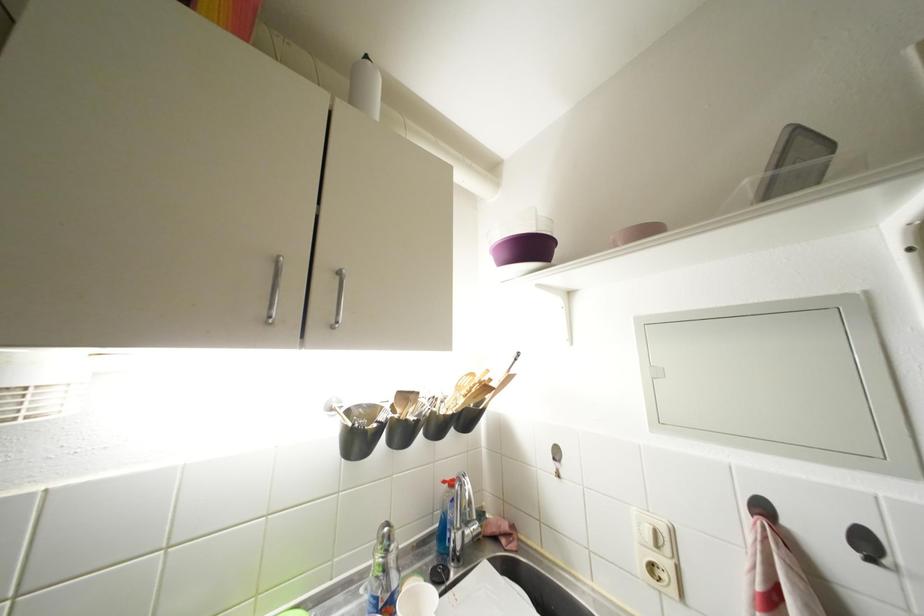
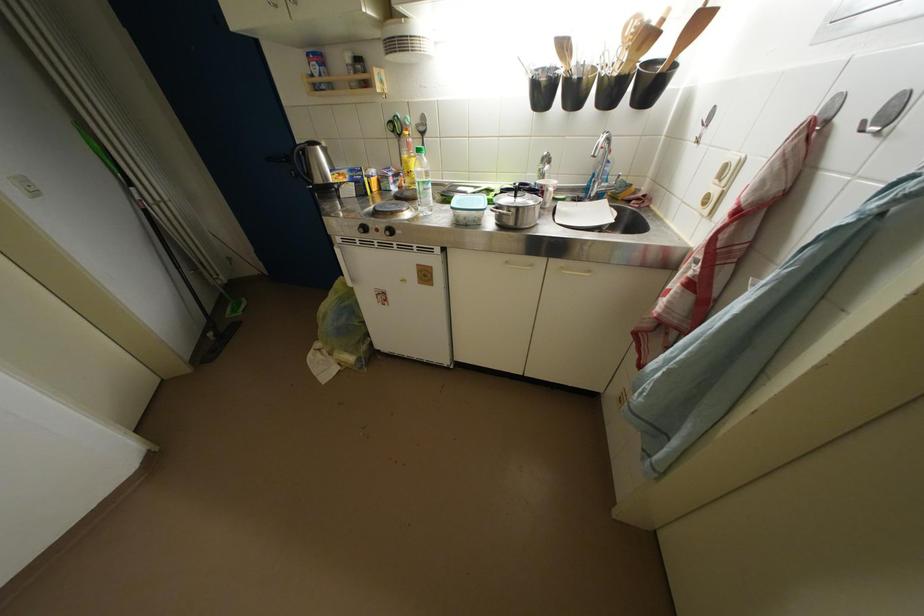
Locate, in the second image, the point that corresponds to pixel 390 541 in the first image.

(551, 161)